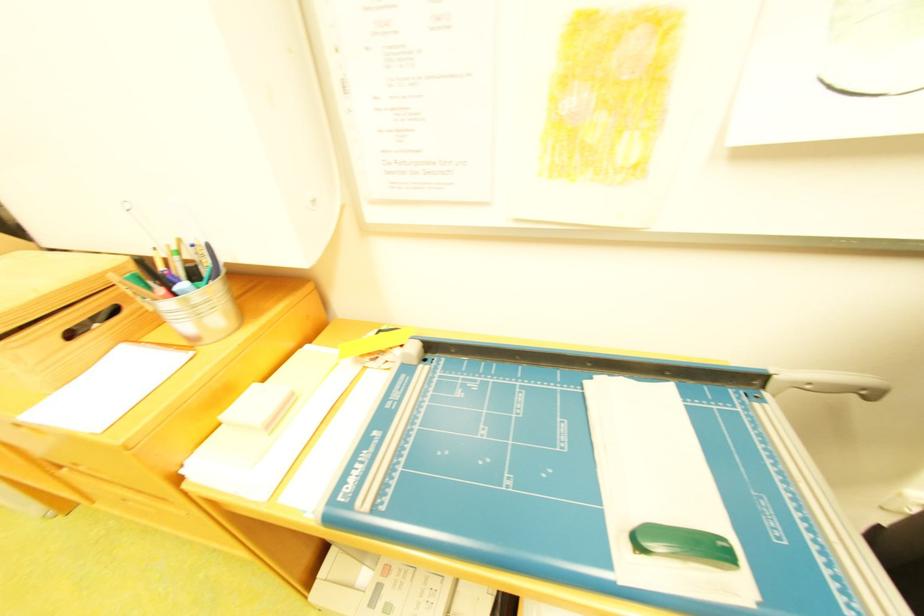
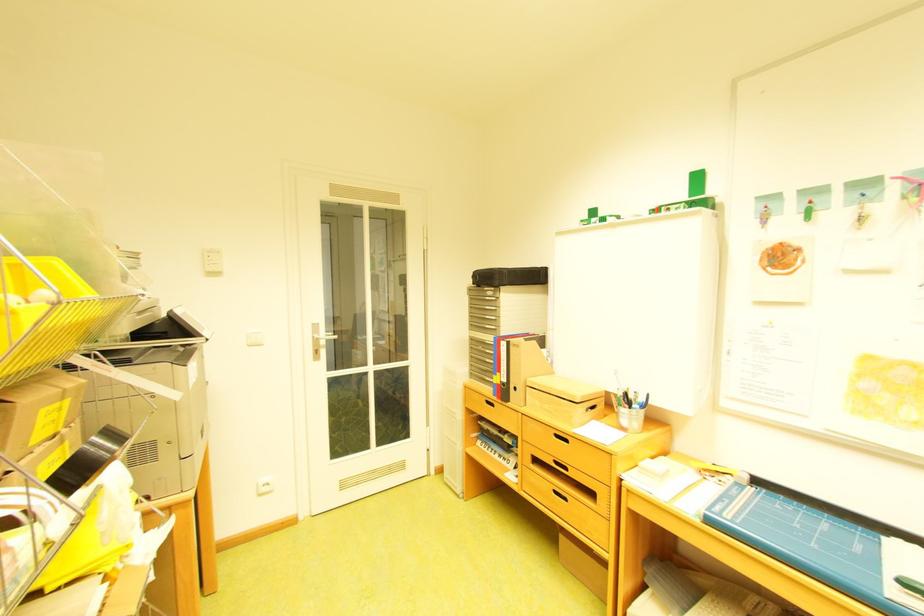
Where in the second image is the point corresponding to the point at 394,492 from the first image?

(747, 517)